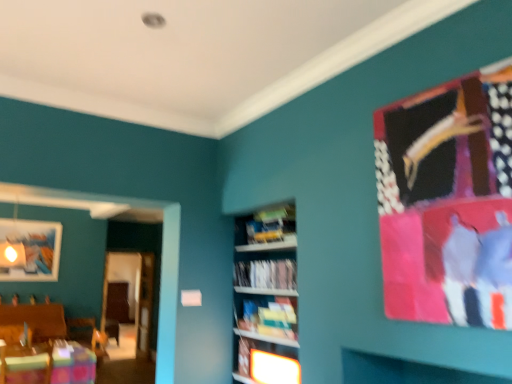
Question: From a real-world perspective, is white paper at center, the 1th book positioned from the top, positioned above or below matte white shelf at center?

Choices:
 (A) above
 (B) below

Answer: (A)

Question: From the image's perspective, is white paper at center, the 1th book positioned from the top, located above or below matte white shelf at center?

Choices:
 (A) below
 (B) above

Answer: (B)

Question: Which of these objects is positioned closest to the matte white shelf at center?

Choices:
 (A) yellow paperback book at center, placed as the 1th book when sorted from bottom to top
 (B) wooden table at lower left
 (C) white paper at center, the 1th book positioned from the top
 (D) matte wooden picture frame at upper left

Answer: (A)

Question: Considering the real-world distances, which object is farthest from the wooden table at lower left?

Choices:
 (A) matte white shelf at center
 (B) yellow paperback book at center, placed as the 1th book when sorted from bottom to top
 (C) matte wooden picture frame at upper left
 (D) white paper at center, the 1th book positioned from the top

Answer: (D)